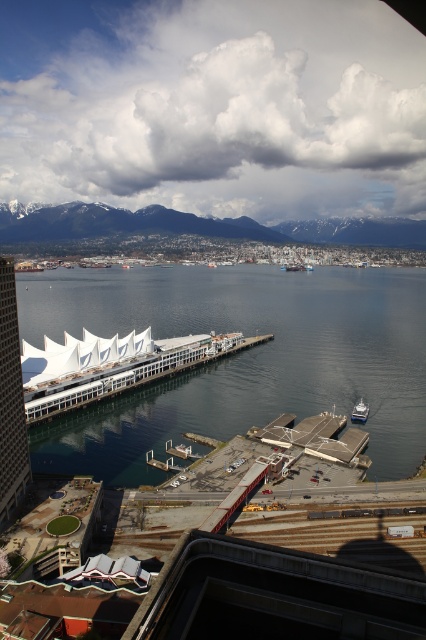
Question: Estimate the real-world distances between objects in this image. Which object is farther from the snowy mountain range at upper center?

Choices:
 (A) clear blue water at center
 (B) metallic silver boat at lower right

Answer: (B)

Question: Does clear blue water at center appear on the right side of metallic silver boat at lower right?

Choices:
 (A) yes
 (B) no

Answer: (A)

Question: Which object appears closest to the camera in this image?

Choices:
 (A) clear blue water at center
 (B) metallic silver boat at lower right

Answer: (A)

Question: Which object appears closest to the camera in this image?

Choices:
 (A) snowy mountain range at upper center
 (B) clear blue water at center
 (C) white matte dock at lower left
 (D) metallic silver boat at lower right

Answer: (B)

Question: Can you confirm if clear blue water at center is thinner than white matte dock at lower left?

Choices:
 (A) yes
 (B) no

Answer: (B)

Question: Is clear blue water at center thinner than metallic silver boat at lower right?

Choices:
 (A) no
 (B) yes

Answer: (A)